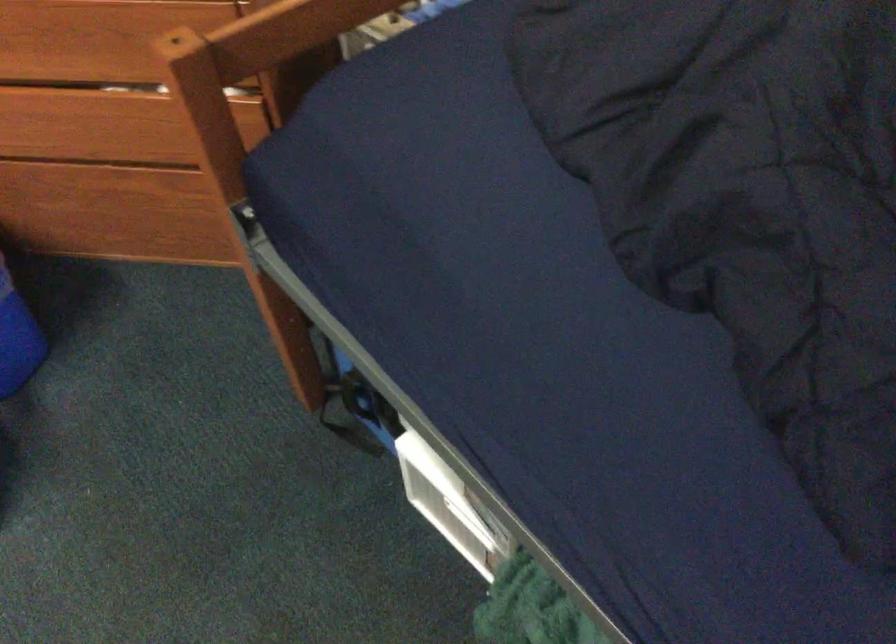
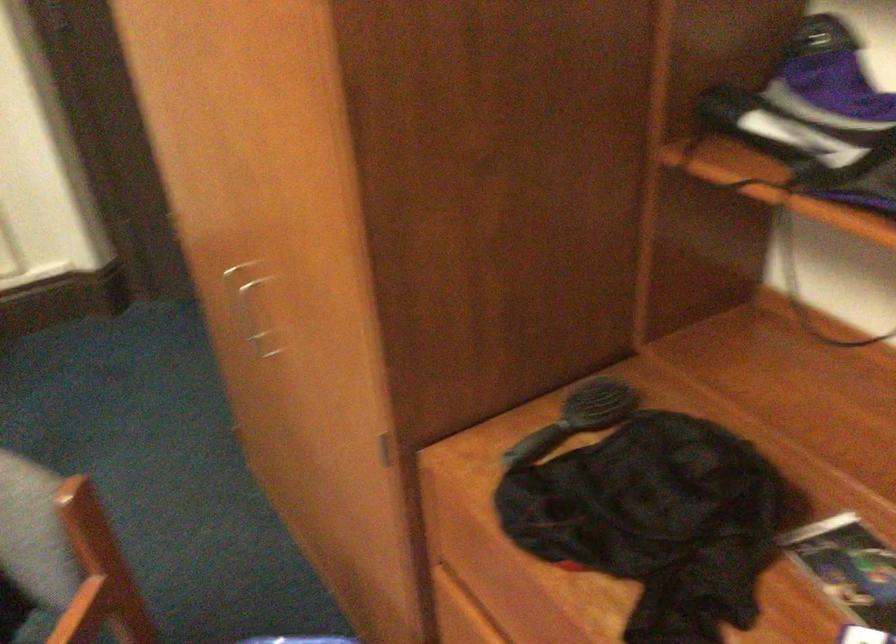
Question: Based on the continuous images, in which direction is the camera rotating? Reply with the corresponding letter.

Choices:
 (A) Left
 (B) Right
 (C) Up
 (D) Down

Answer: (A)